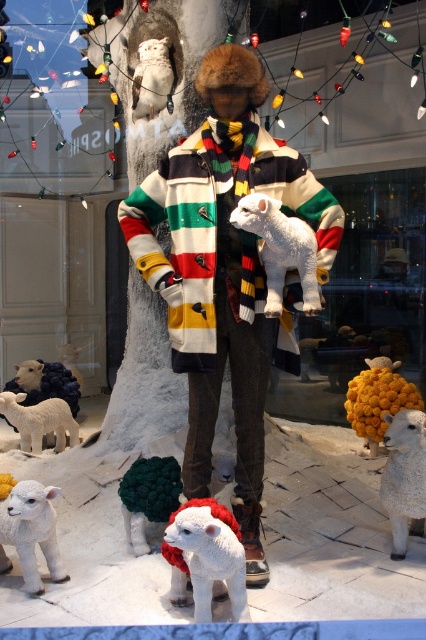
In the scene shown: Between striped wool coat at center and striped woolen sweater at center, which one has more height?

With more height is striped wool coat at center.

Is striped wool coat at center smaller than striped woolen sweater at center?

Incorrect, striped wool coat at center is not smaller in size than striped woolen sweater at center.

Is point (144, 232) farther from camera compared to point (196, 196)?

Yes, it is.

Locate an element on the screen. The width and height of the screenshot is (426, 640). striped wool coat at center is located at coordinates (226, 269).

Which of these two, striped woolen sweater at center or fluffy white lamb at lower center, stands taller?

striped woolen sweater at center

Which is behind, point (172, 156) or point (124, 509)?

Point (124, 509)

Find the location of a particular element. This screenshot has width=426, height=640. striped woolen sweater at center is located at coordinates (215, 220).

Does multicolored string lights at upper center have a greater width compared to fluffy white lamb at lower center?

Indeed, multicolored string lights at upper center has a greater width compared to fluffy white lamb at lower center.

At what (x,y) coordinates should I click in order to perform the action: click on multicolored string lights at upper center. Please return your answer as a coordinate pair (x, y). The height and width of the screenshot is (640, 426). Looking at the image, I should click on (103, 93).

Is point (374, 129) farther from viewer compared to point (164, 470)?

Yes, point (374, 129) is behind point (164, 470).

What are the coordinates of `multicolored string lights at upper center` in the screenshot? It's located at (103, 93).